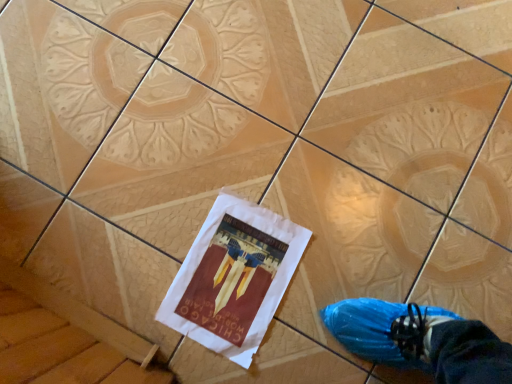
Describe the element at coordinates (234, 278) in the screenshot. I see `white paper postcard at lower left` at that location.

Looking at this image, measure the distance between white paper postcard at lower left and camera.

white paper postcard at lower left is 82.20 centimeters from camera.

Where is `white paper postcard at lower left`? The width and height of the screenshot is (512, 384). white paper postcard at lower left is located at coordinates (234, 278).

At what (x,y) coordinates should I click in order to perform the action: click on white paper postcard at lower left. Please return your answer as a coordinate pair (x, y). This screenshot has height=384, width=512. Looking at the image, I should click on (234, 278).